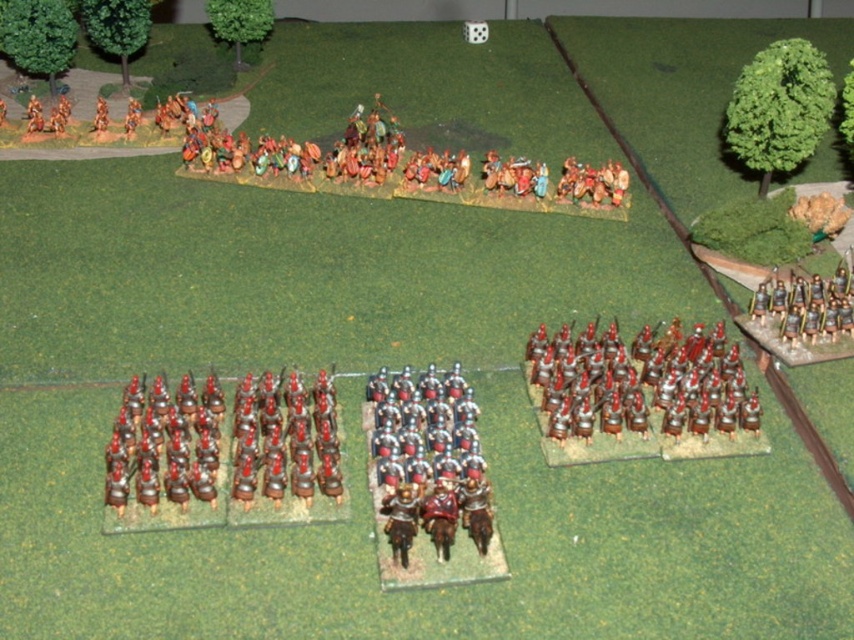
Question: Estimate the real-world distances between objects in this image. Which object is closer to the shiny silver helmeted soldiers at center?

Choices:
 (A) metallic silver soldiers at center
 (B) shiny silver armor at center
 (C) metallic silver soldiers at right
 (D) shiny silver helmets at lower left

Answer: (B)

Question: Which point appears farthest from the camera in this image?

Choices:
 (A) (619, 420)
 (B) (825, 292)

Answer: (B)

Question: Does shiny silver helmeted soldiers at center appear on the left side of shiny silver armor at center?

Choices:
 (A) no
 (B) yes

Answer: (A)

Question: Can you confirm if shiny silver helmeted soldiers at center is bigger than metallic silver soldiers at center?

Choices:
 (A) yes
 (B) no

Answer: (A)

Question: Is metallic silver soldiers at center further to the viewer compared to metallic silver soldiers at right?

Choices:
 (A) no
 (B) yes

Answer: (A)

Question: Among these points, which one is farthest from the camera?

Choices:
 (A) (249, 388)
 (B) (401, 417)
 (C) (629, 388)
 (D) (186, 506)

Answer: (C)